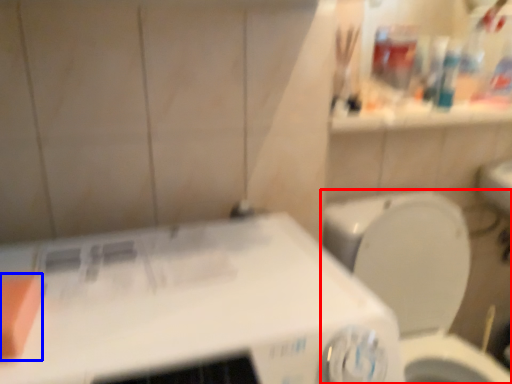
Question: Among these objects, which one is nearest to the camera, toilet (highlighted by a red box) or soap (highlighted by a blue box)?

Choices:
 (A) toilet
 (B) soap

Answer: (B)